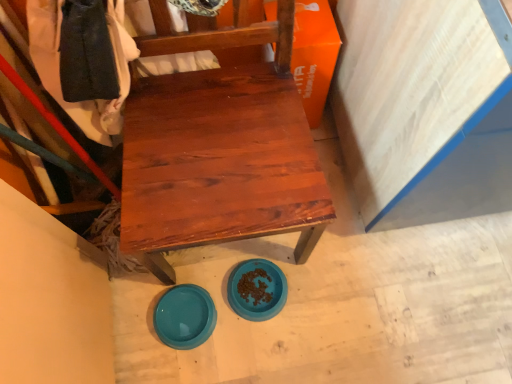
Locate an element on the screen. The image size is (512, 384). free location above orange matte cardboard box at upper right (from a real-world perspective) is located at coordinates (313, 21).